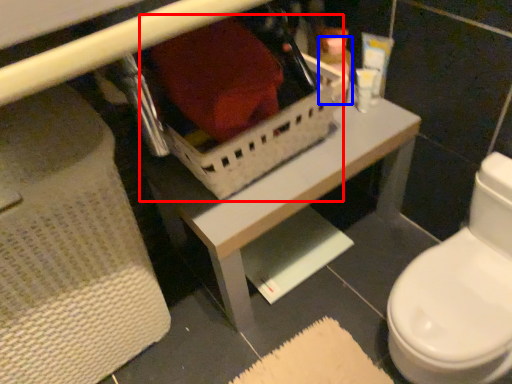
Question: Which object is further to the camera taking this photo, storage box (highlighted by a red box) or toiletry (highlighted by a blue box)?

Choices:
 (A) storage box
 (B) toiletry

Answer: (B)